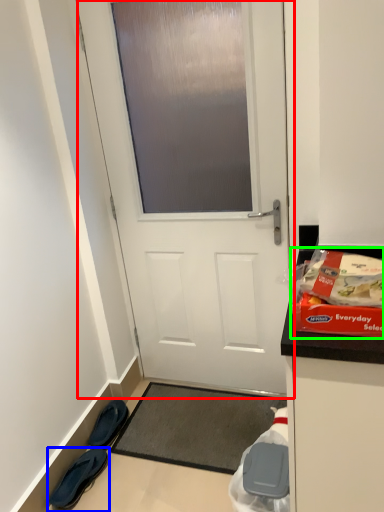
Question: Estimate the real-world distances between objects in this image. Which object is closer to door (highlighted by a red box), footwear (highlighted by a blue box) or waste (highlighted by a green box)?

Choices:
 (A) footwear
 (B) waste

Answer: (B)